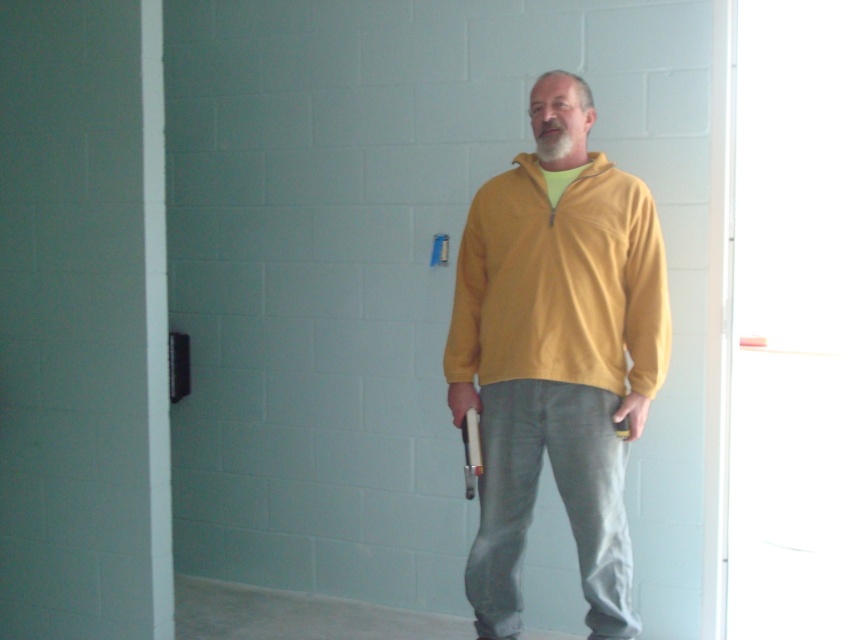
Is yellow fleece jacket at center behind yellow fleece sweatshirt at center?

No.

What do you see at coordinates (556, 355) in the screenshot? The width and height of the screenshot is (853, 640). I see `yellow fleece jacket at center` at bounding box center [556, 355].

Where is `yellow fleece jacket at center`? This screenshot has width=853, height=640. yellow fleece jacket at center is located at coordinates (556, 355).